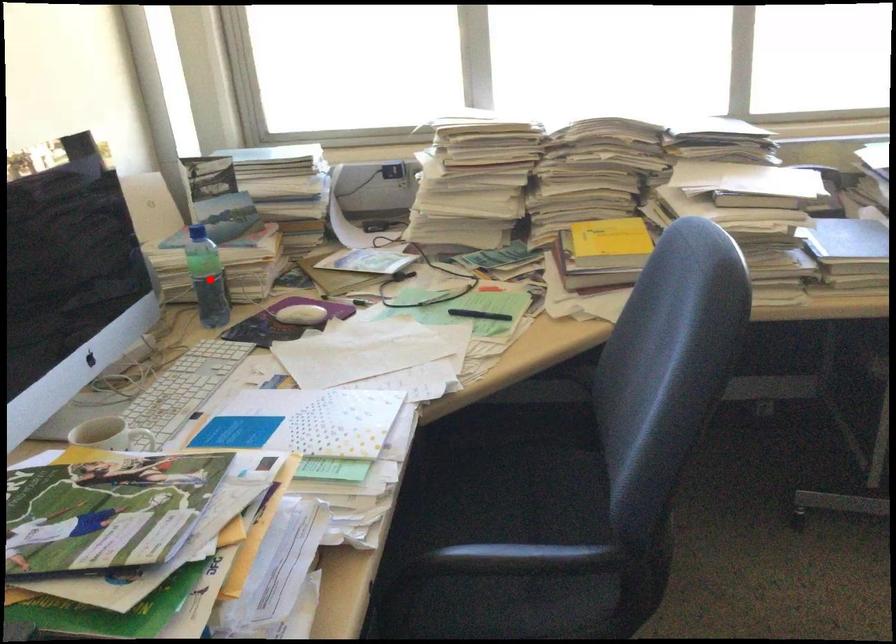
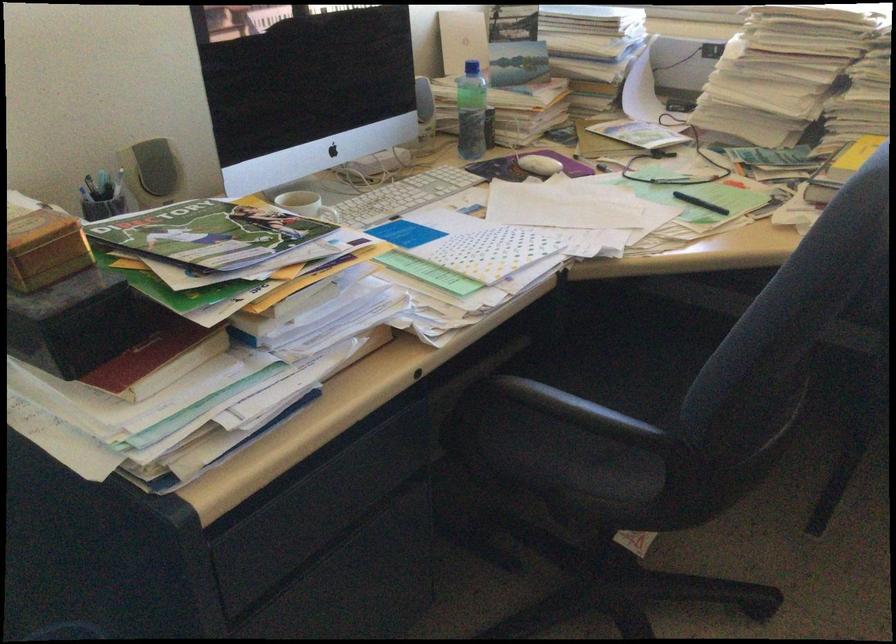
Question: I am providing you with two images of the same scene from different viewpoints. In image1, a red point is highlighted. Considering the same 3D point in image2, which of the following is correct?

Choices:
 (A) It is closer
 (B) It is farther

Answer: (B)